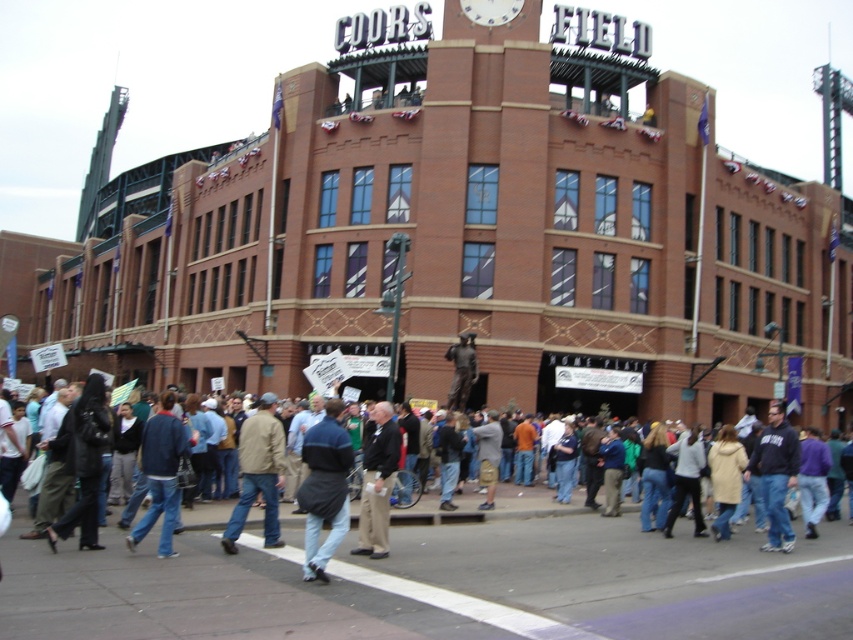
Question: Which is nearer to the dark gray jacket at center?

Choices:
 (A) dark blue sweatshirt at lower right
 (B) denim jacket at lower left
 (C) dark blue jacket at center

Answer: (C)

Question: Can you confirm if denim jacket at center is bigger than denim jacket at lower left?

Choices:
 (A) no
 (B) yes

Answer: (B)

Question: Can you confirm if light brown leather jacket at center is positioned above dark blue sweatshirt at lower right?

Choices:
 (A) yes
 (B) no

Answer: (A)

Question: Is light brown leather jacket at center to the right of dark gray jacket at center from the viewer's perspective?

Choices:
 (A) no
 (B) yes

Answer: (A)

Question: Among these points, which one is farthest from the camera?

Choices:
 (A) (397, 449)
 (B) (10, 531)
 (C) (769, 513)
 (D) (247, 486)

Answer: (C)

Question: Which of the following is the farthest from the observer?

Choices:
 (A) (405, 515)
 (B) (312, 568)

Answer: (A)